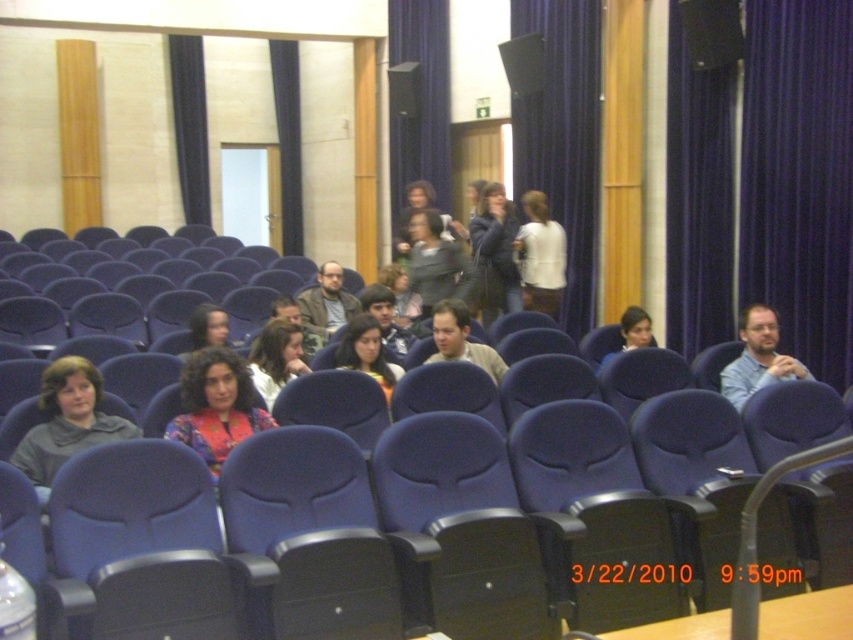
You are sitting in the front row of the lecture hall and want to reach a specific location. You have two options to choose from, either point (241, 436) or point (531, 230). Which point should you go to if you want to reach the one that is closer to you?

You should go to point (241, 436) because it is closer to the viewer than point (531, 230).

You are sitting in the front row of the lecture hall and notice two points marked in the middle ground. Which of the two points, point (572, 253) or point (473, 241), is closer to you?

Point (572, 253) is closer to you because it is further to the viewer than point (473, 241).

You are sitting in the front row of the lecture hall and notice two jackets in the middle ground. Which one is positioned to the left when looking at the matte brown jacket at center and the matte black jacket at upper center?

The matte brown jacket at center is positioned to the left of the matte black jacket at upper center.